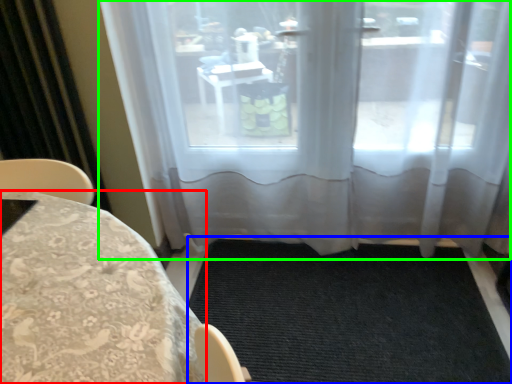
Question: Considering the real-world distances, which object is farthest from furniture (highlighted by a red box)? doormat (highlighted by a blue box) or window (highlighted by a green box)?

Choices:
 (A) doormat
 (B) window

Answer: (B)